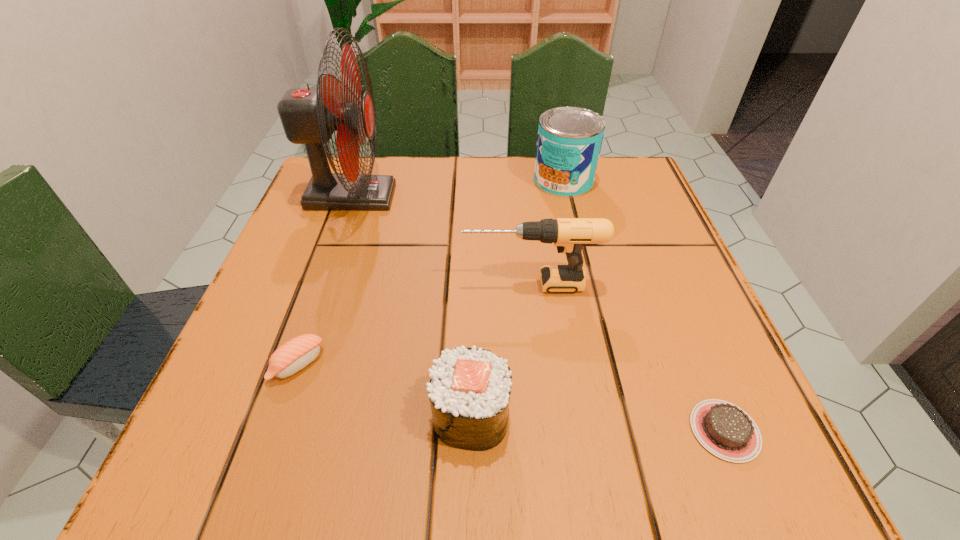
Identify the location of free space located 0.290m on the left of the can. The height and width of the screenshot is (540, 960). (403, 180).

The height and width of the screenshot is (540, 960). Find the location of `vacant area located on the handle side of the third farthest object`. vacant area located on the handle side of the third farthest object is located at coordinates (346, 284).

The image size is (960, 540). I want to click on blank area located 0.080m on the handle side of the third farthest object, so click(x=417, y=284).

What are the coordinates of `vacant space located on the handle side of the third farthest object` in the screenshot? It's located at (404, 284).

Where is `free space located 0.140m on the left of the right sushi`? free space located 0.140m on the left of the right sushi is located at coordinates (326, 415).

Image resolution: width=960 pixels, height=540 pixels. In order to click on vacant space located 0.090m on the back of the shorter sushi in this screenshot , I will do `click(320, 300)`.

I want to click on vacant space located 0.270m on the back of the shortest object, so click(x=657, y=264).

You are a GUI agent. You are given a task and a screenshot of the screen. Output one action in this format:
    pyautogui.click(x=<x>, y=<y>)
    Task: Click on the fan that is at the far edge
    The image size is (960, 540).
    Given the screenshot: What is the action you would take?
    pyautogui.click(x=309, y=116)

The height and width of the screenshot is (540, 960). What are the coordinates of `can at the far edge` in the screenshot? It's located at (569, 141).

Locate an element on the screen. sushi at the near edge is located at coordinates (469, 391).